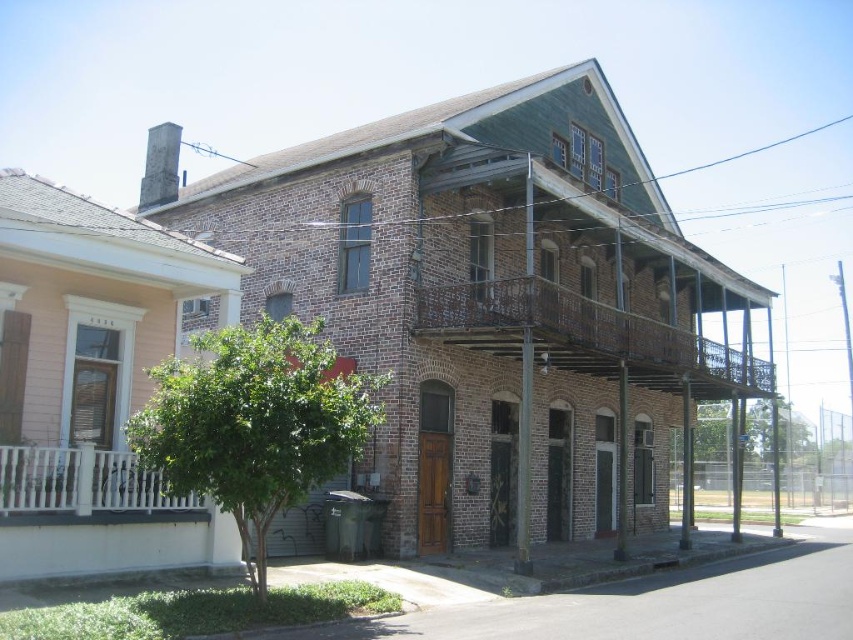
You are a maintenance worker inspecting the building. You notice the rusty metal balcony at center and the white painted wood at left. Which of these two features is positioned higher up on the building?

The rusty metal balcony at center is located above the white painted wood at left, so it is positioned higher up on the building.

You are an architect assessing the structural integrity of the building. You notice the rusty metal balcony at center and the white painted wood at left. Which of these two elements is more likely to require immediate reinforcement based on their sizes?

The rusty metal balcony at center has a larger size compared to the white painted wood at left, so it is more likely to require immediate reinforcement due to its greater size potentially leading to higher structural stress.

You are standing in front of the two story brick building. You want to know where the rusty metal balcony at center is located. Can you tell me its position using the coordinate system provided?

The rusty metal balcony at center is located at point (585, 337).